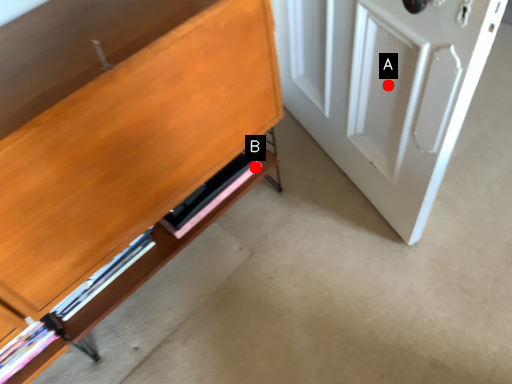
Question: Two points are circled on the image, labeled by A and B beside each circle. Which point appears farthest from the camera in this image?

Choices:
 (A) A is further
 (B) B is further

Answer: (B)